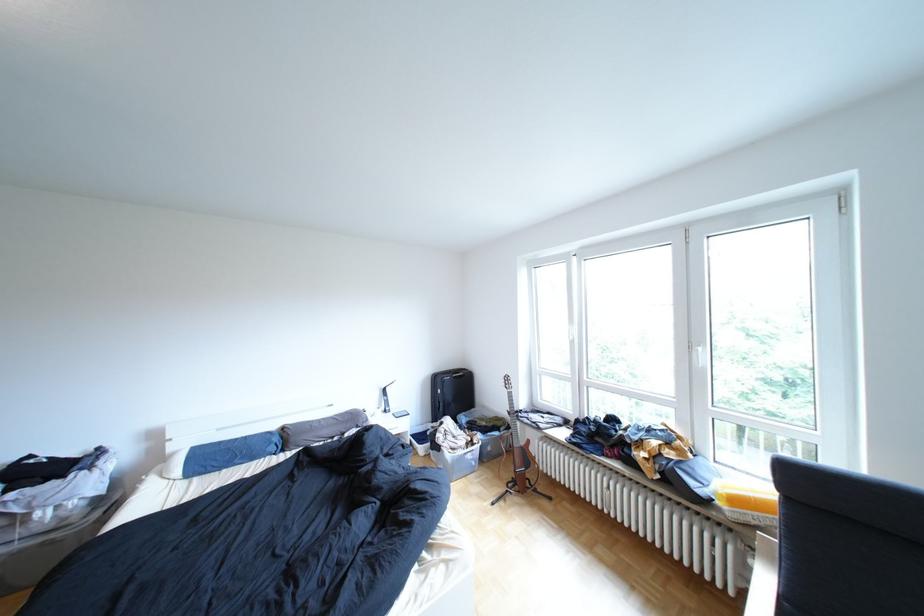
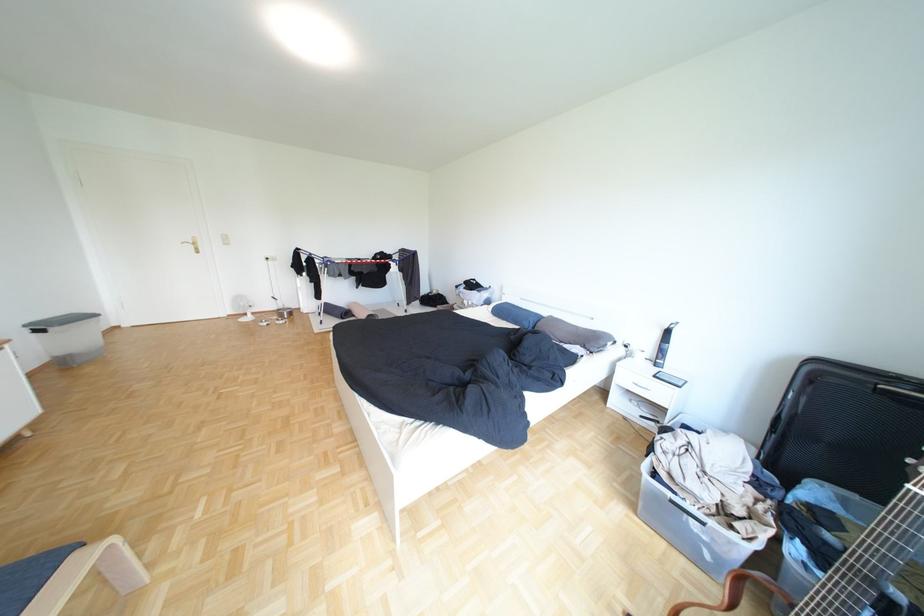
Locate, in the second image, the point that corresponds to the point at 372,427 in the first image.

(600, 347)